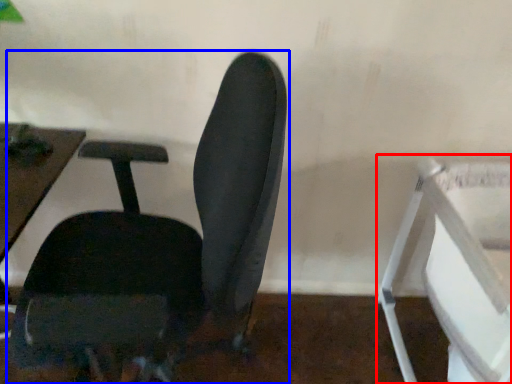
Question: Which point is further to the camera, feeding chair (highlighted by a red box) or chair (highlighted by a blue box)?

Choices:
 (A) feeding chair
 (B) chair

Answer: (A)